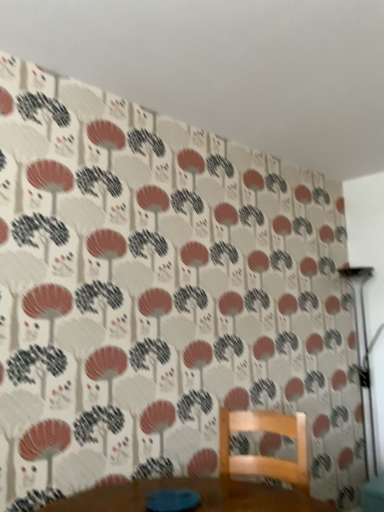
Question: Which is correct: metallic silver table lamp at right is inside wooden chair at center, or outside of it?

Choices:
 (A) outside
 (B) inside

Answer: (A)

Question: Visually, is metallic silver table lamp at right positioned to the left or to the right of wooden chair at center?

Choices:
 (A) right
 (B) left

Answer: (A)

Question: Is metallic silver table lamp at right in front of or behind wooden chair at center in the image?

Choices:
 (A) behind
 (B) front

Answer: (A)

Question: Is point (296, 478) positioned closer to the camera than point (365, 275)?

Choices:
 (A) farther
 (B) closer

Answer: (B)

Question: Relative to metallic silver table lamp at right, is wooden chair at center in front or behind?

Choices:
 (A) behind
 (B) front

Answer: (B)

Question: From the image's perspective, relative to metallic silver table lamp at right, is wooden chair at center above or below?

Choices:
 (A) below
 (B) above

Answer: (A)

Question: In terms of size, does wooden chair at center appear bigger or smaller than metallic silver table lamp at right?

Choices:
 (A) small
 (B) big

Answer: (A)